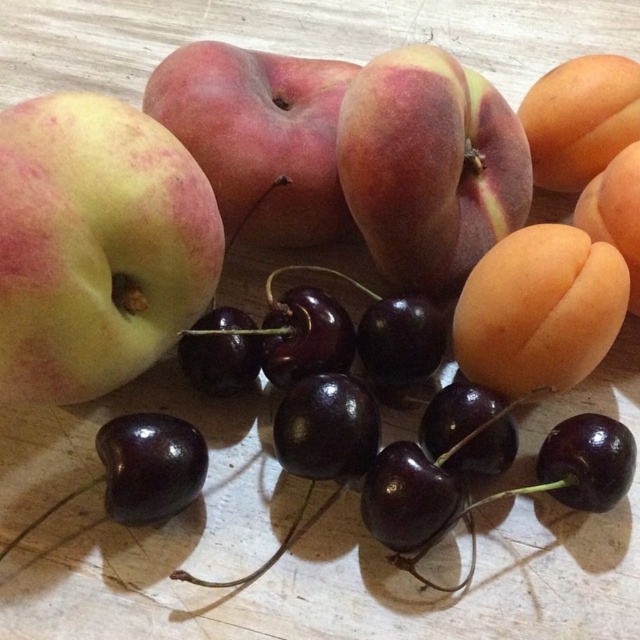
The height and width of the screenshot is (640, 640). Describe the element at coordinates (97, 244) in the screenshot. I see `matte yellow apple at center` at that location.

Who is taller, matte yellow apple at center or matte green apple at center?

Standing taller between the two is matte yellow apple at center.

Is point (106, 250) positioned before point (237, 76)?

That is True.

This screenshot has height=640, width=640. I want to click on matte yellow apple at center, so click(x=97, y=244).

Is point (412, 193) positioned before point (269, 232)?

Yes, point (412, 193) is in front of point (269, 232).

Locate an element on the screen. matte peach at center is located at coordinates (429, 166).

Who is more distant from viewer, (365, 243) or (272, 244)?

Positioned behind is point (272, 244).

The image size is (640, 640). In order to click on matte peach at center in this screenshot , I will do `click(429, 166)`.

Does matte peach at center have a greater height compared to orange matte/apricot at right?

Correct, matte peach at center is much taller as orange matte/apricot at right.

Does matte peach at center have a lesser width compared to orange matte/apricot at right?

In fact, matte peach at center might be wider than orange matte/apricot at right.

Does point (388, 257) lie behind point (580, 129)?

No.

The width and height of the screenshot is (640, 640). Identify the location of matte peach at center. (429, 166).